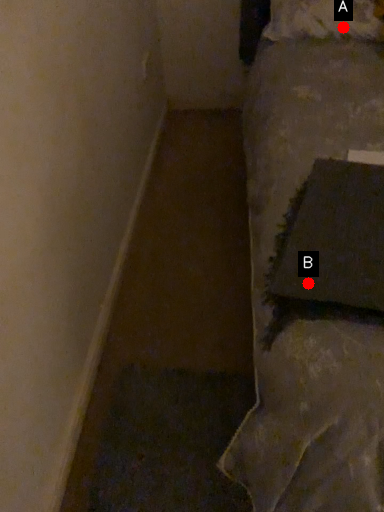
Question: Two points are circled on the image, labeled by A and B beside each circle. Among these points, which one is nearest to the camera?

Choices:
 (A) A is closer
 (B) B is closer

Answer: (B)